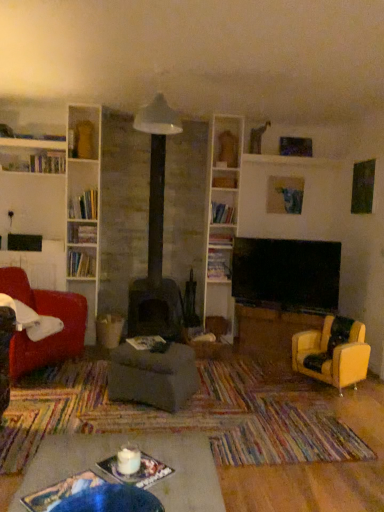
Find the location of a particular element. The height and width of the screenshot is (512, 384). free space below wooden bookshelf at center, acting as the 4th shelf starting from the top (from a real-world perspective) is located at coordinates (221, 315).